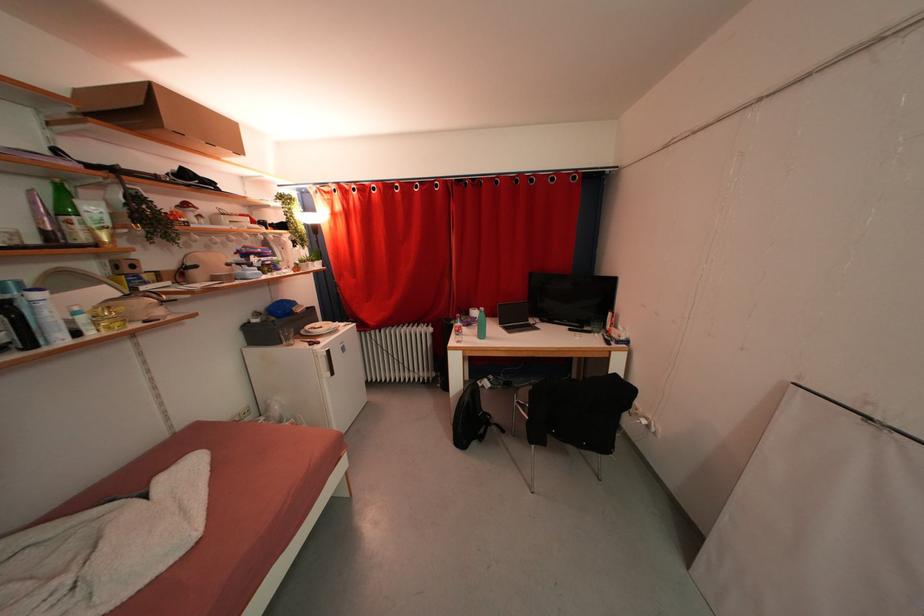
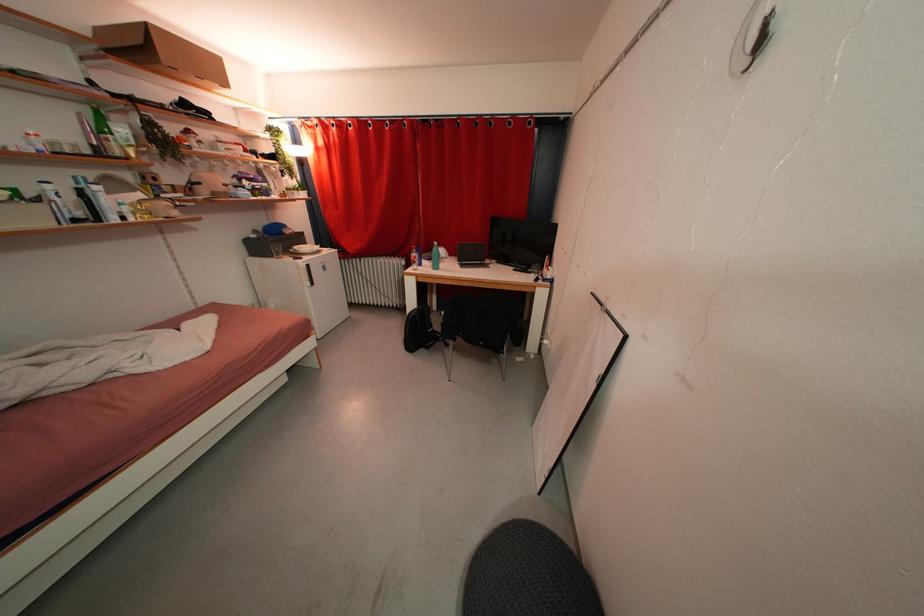
Find the pixel in the second image that matches point 496,428 in the first image.

(444, 344)